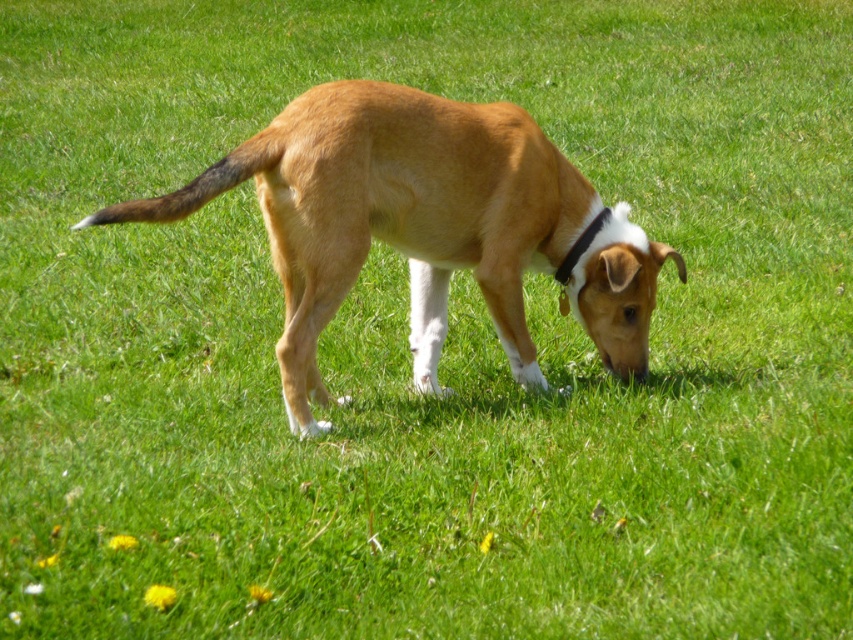
You are a photographer trying to capture the golden fur dog at center with its black fabric neckband at center in focus. Since the dog is larger than the neckband, which one should you adjust your camera focus on first to ensure both are sharp?

Since the golden fur dog at center is larger than the black fabric neckband at center, you should focus on the golden fur dog at center first as it occupies more of the frame, ensuring it is sharp before adjusting for the smaller neckband.

You are a photographer trying to capture the golden fur dog at center and the black fabric neckband at center in the same frame. Based on their positions, which object should you adjust your camera to focus on first to ensure both are in the shot?

The golden fur dog at center is to the left of black fabric neckband at center, so you should focus on the golden fur dog at center first to ensure both are in the frame.